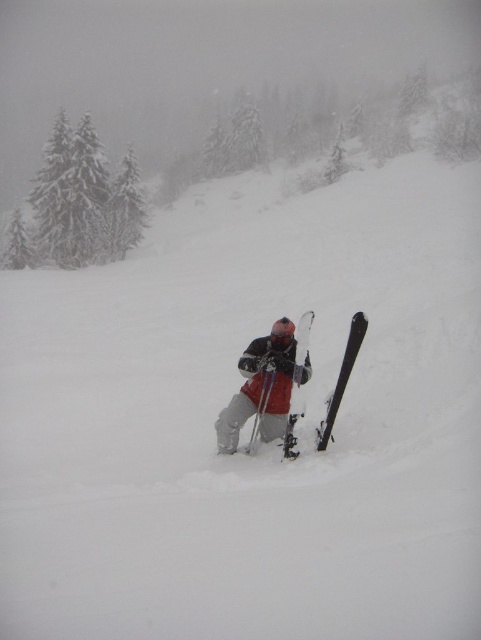
You are a skier preparing to descend a steep slope. You notice the black matte ski at lower center. Where exactly is the black matte ski positioned relative to your current location on the slope?

The black matte ski at lower center is positioned at coordinates approximately 0.592 on the horizontal axis and 0.711 on the vertical axis relative to your current location on the slope.

You are a mountain rescue team member trying to locate a skier in a snowy area. You have coordinates for a point that might indicate their location. According to the scene, what object is located at point coordinates (264, 387)?

The point coordinates (264, 387) mark the location of the matte gray ski suit at center.